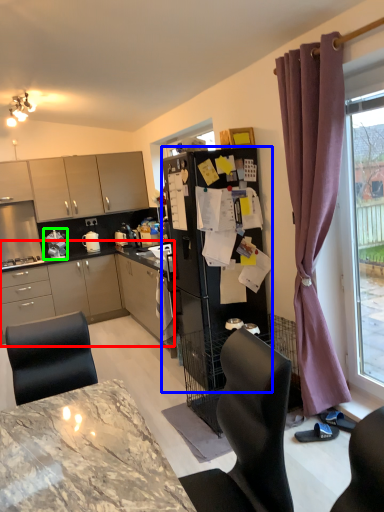
Question: Which is nearer to the cabinetry (highlighted by a red box)? refrigerator (highlighted by a blue box) or appliance (highlighted by a green box).

Choices:
 (A) refrigerator
 (B) appliance

Answer: (B)